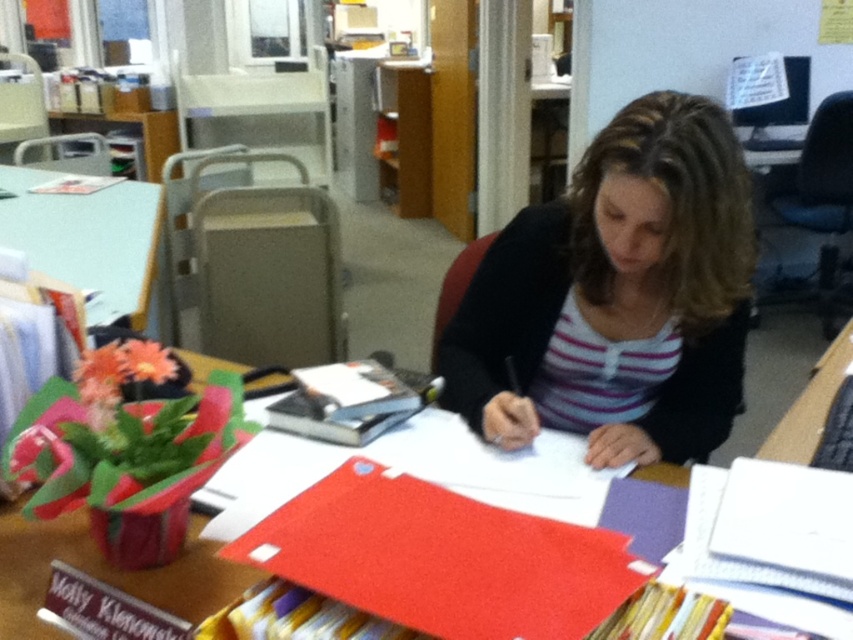
Between point (631, 161) and point (288, 396), which one is positioned in front?

Point (631, 161) is more forward.

Is striped knit sweater at center to the right of hardcover book at center from the viewer's perspective?

Indeed, striped knit sweater at center is positioned on the right side of hardcover book at center.

Which is in front, point (682, 417) or point (311, 404)?

Point (311, 404) is in front.

Find the location of `striped knit sweater at center`. striped knit sweater at center is located at coordinates (618, 296).

This screenshot has width=853, height=640. What do you see at coordinates (103, 572) in the screenshot?
I see `white paper at center` at bounding box center [103, 572].

Looking at this image, between white paper at center and green plastic table at upper left, which one is positioned higher?

green plastic table at upper left is above.

Which is in front, point (165, 568) or point (18, 218)?

Point (165, 568) is more forward.

You are a GUI agent. You are given a task and a screenshot of the screen. Output one action in this format:
    pyautogui.click(x=<x>, y=<y>)
    Task: Click on the white paper at center
    The width and height of the screenshot is (853, 640).
    Given the screenshot: What is the action you would take?
    pyautogui.click(x=103, y=572)

What do you see at coordinates (618, 296) in the screenshot? I see `striped knit sweater at center` at bounding box center [618, 296].

Is striped knit sweater at center below white paper at center?

Actually, striped knit sweater at center is above white paper at center.

Which is behind, point (642, 397) or point (38, 564)?

Positioned behind is point (642, 397).

The image size is (853, 640). In order to click on striped knit sweater at center in this screenshot , I will do tap(618, 296).